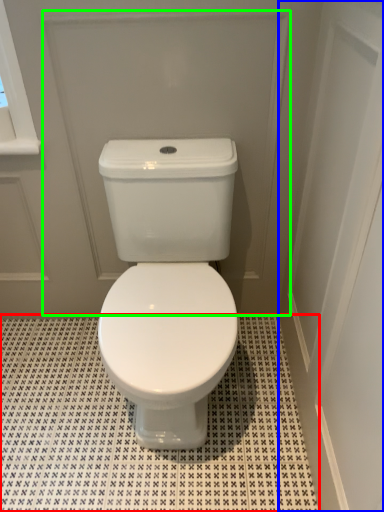
Question: Based on their relative distances, which object is farther from tile (highlighted by a red box)? Choose from screen door (highlighted by a blue box) and screen door (highlighted by a green box).

Choices:
 (A) screen door
 (B) screen door

Answer: (B)